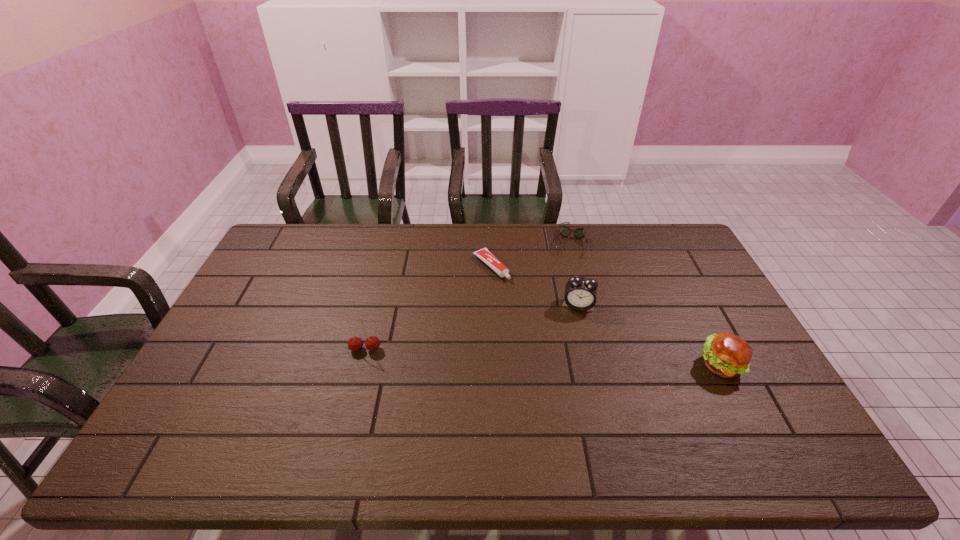
This screenshot has width=960, height=540. Identify the location of the leftmost object. (372, 343).

The image size is (960, 540). What are the coordinates of `hamburger` in the screenshot? It's located at (728, 355).

You are a GUI agent. You are given a task and a screenshot of the screen. Output one action in this format:
    pyautogui.click(x=<x>, y=<y>)
    Task: Click on the rightmost object
    The height and width of the screenshot is (540, 960).
    Given the screenshot: What is the action you would take?
    pyautogui.click(x=728, y=355)

Find the location of a particular element. toothpaste is located at coordinates (485, 255).

I want to click on the shortest object, so [485, 255].

The height and width of the screenshot is (540, 960). Find the location of `the fourth tallest object`. the fourth tallest object is located at coordinates (564, 231).

Where is `alarm clock`? alarm clock is located at coordinates (580, 291).

Find the location of a particular element. The height and width of the screenshot is (540, 960). vacant region located on the surface of the leftmost object is located at coordinates (350, 409).

The width and height of the screenshot is (960, 540). What are the coordinates of `blank space located on the front of the third tallest object` in the screenshot? It's located at (749, 422).

Find the location of `free space located 0.360m at the nozzle of the shortest object`. free space located 0.360m at the nozzle of the shortest object is located at coordinates (577, 350).